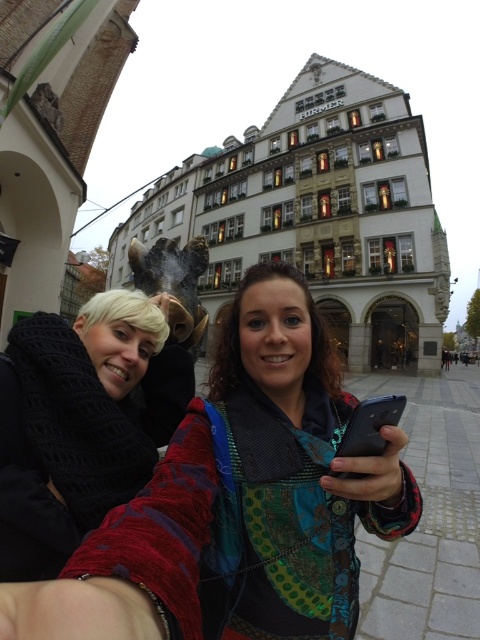
Looking at this image, does black knitted scarf at left appear on the right side of black glossy smartphone at lower center?

Incorrect, black knitted scarf at left is not on the right side of black glossy smartphone at lower center.

Is black knitted scarf at left bigger than black glossy smartphone at lower center?

Yes, black knitted scarf at left is bigger than black glossy smartphone at lower center.

Is point (16, 492) more distant than point (358, 442)?

No, it is in front of (358, 442).

The height and width of the screenshot is (640, 480). What are the coordinates of `black knitted scarf at left` in the screenshot? It's located at (71, 426).